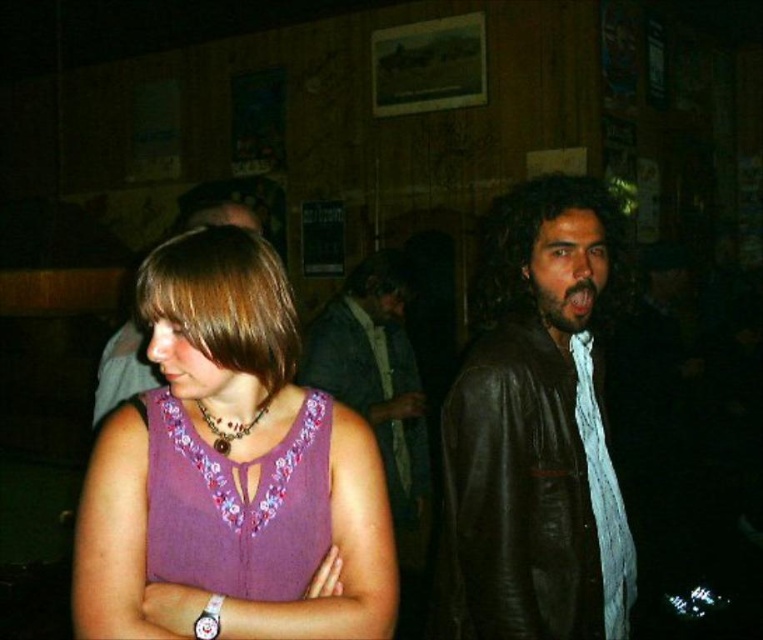
Question: Does leather jacket at center appear over matte brown leather jacket at center?

Choices:
 (A) yes
 (B) no

Answer: (B)

Question: Which object is positioned closest to the purple knit top at center?

Choices:
 (A) matte brown leather jacket at center
 (B) leather jacket at center
 (C) purple embroidered dress at center

Answer: (C)

Question: Which of the following is the closest to the observer?

Choices:
 (A) purple knit top at center
 (B) matte brown leather jacket at center

Answer: (A)

Question: Does purple embroidered dress at center appear on the left side of matte brown leather jacket at center?

Choices:
 (A) yes
 (B) no

Answer: (B)

Question: Among these points, which one is farthest from the camera?

Choices:
 (A) (240, 429)
 (B) (271, 484)
 (C) (126, 298)
 (D) (497, 454)

Answer: (C)

Question: Is leather jacket at center closer to the viewer compared to brown beaded necklace at center?

Choices:
 (A) yes
 (B) no

Answer: (B)